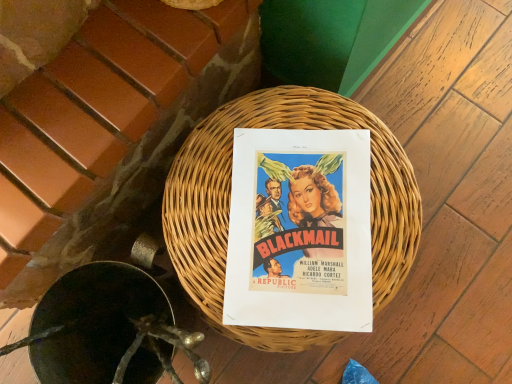
Where is `matte paper poster at center`? Image resolution: width=512 pixels, height=384 pixels. matte paper poster at center is located at coordinates (300, 231).

This screenshot has height=384, width=512. What do you see at coordinates (300, 231) in the screenshot?
I see `matte paper poster at center` at bounding box center [300, 231].

The image size is (512, 384). I want to click on matte paper poster at center, so 300,231.